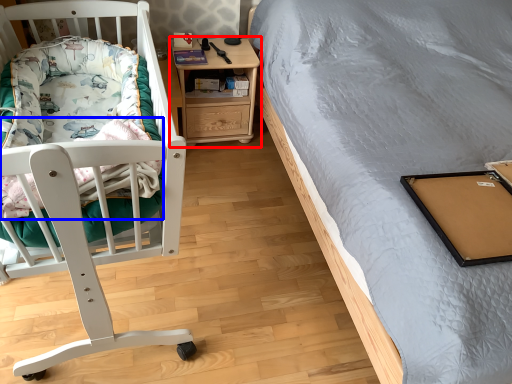
Question: Which point is closer to the camera, nightstand (highlighted by a red box) or blanket (highlighted by a blue box)?

Choices:
 (A) nightstand
 (B) blanket

Answer: (B)